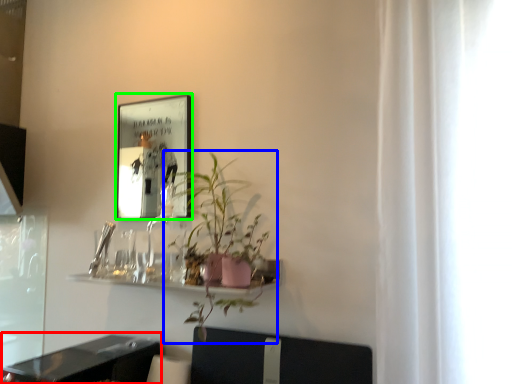
Question: Which object is positioned closest to table (highlighted by a red box)? Select from houseplant (highlighted by a blue box) and picture frame (highlighted by a green box).

Choices:
 (A) houseplant
 (B) picture frame

Answer: (A)